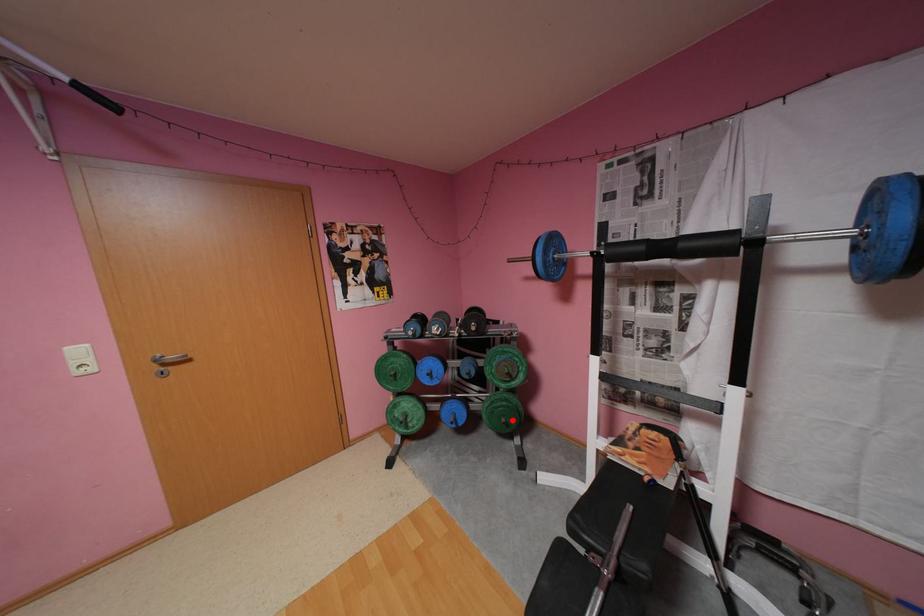
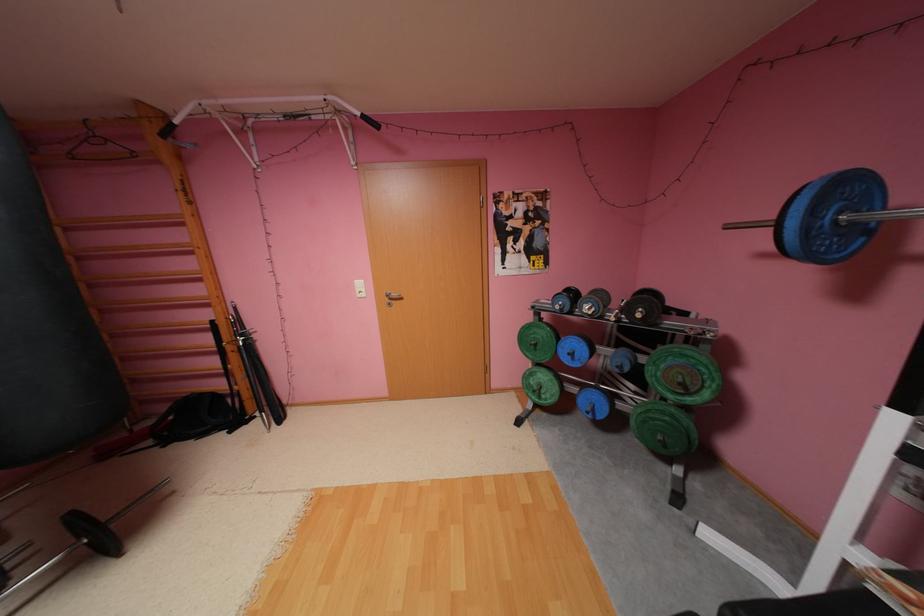
Question: I am providing you with two images of the same scene from different viewpoints. In image1, a red point is highlighted. Considering the same 3D point in image2, which of the following is correct?

Choices:
 (A) It is closer
 (B) It is farther

Answer: (A)